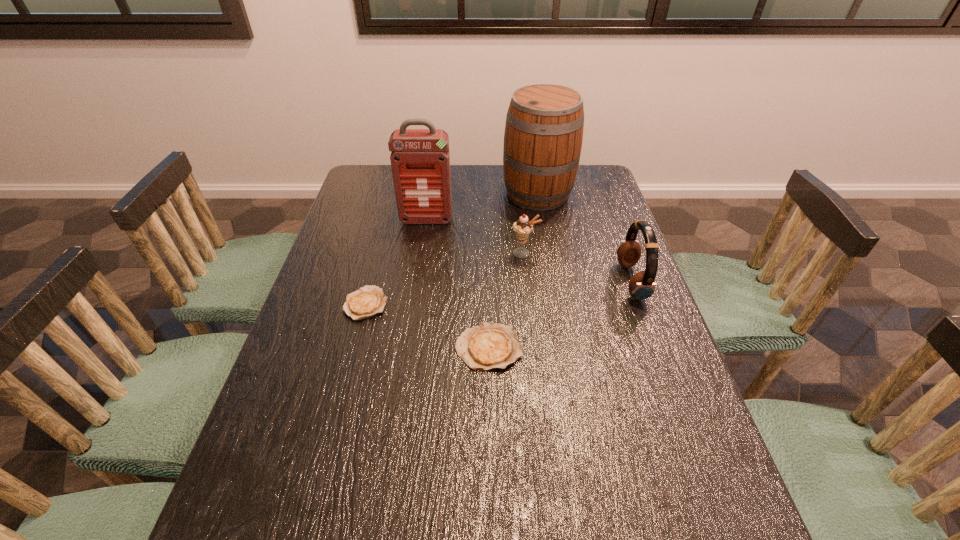
Locate an element on the screen. Image resolution: width=960 pixels, height=540 pixels. object that is positioned at the far right corner is located at coordinates (543, 136).

The width and height of the screenshot is (960, 540). In the image, there is a desktop. Identify the location of free region at the near edge. pyautogui.click(x=501, y=489).

Locate an element on the screen. vacant space at the left edge of the desktop is located at coordinates (381, 256).

The image size is (960, 540). In the image, there is a desktop. In order to click on vacant space at the right edge in this screenshot , I will do [x=613, y=313].

You are a GUI agent. You are given a task and a screenshot of the screen. Output one action in this format:
    pyautogui.click(x=<x>, y=<y>)
    Task: Click on the vacant space at the far left corner
    This screenshot has height=540, width=960.
    Given the screenshot: What is the action you would take?
    pyautogui.click(x=390, y=184)

The width and height of the screenshot is (960, 540). I want to click on free space at the far right corner of the desktop, so click(581, 166).

I want to click on free spot between the farthest object and the fifth tallest object, so click(513, 271).

Identify the location of vacant region between the icecream and the first-aid kit. (475, 237).

You are a GUI agent. You are given a task and a screenshot of the screen. Output one action in this format:
    pyautogui.click(x=<x>, y=<y>)
    Task: Click on the unoccupied area between the fifth nearest object and the farthest object
    The image size is (960, 540).
    Given the screenshot: What is the action you would take?
    pyautogui.click(x=482, y=207)

Where is `blank region between the second shortest object and the headset`? blank region between the second shortest object and the headset is located at coordinates (560, 315).